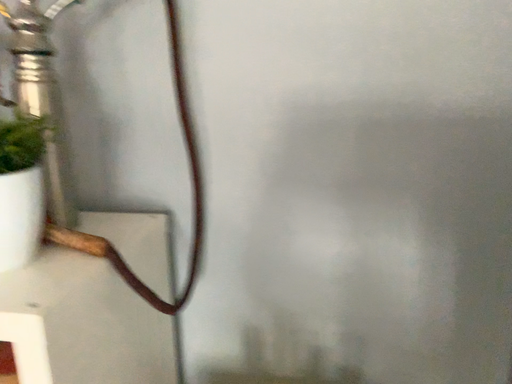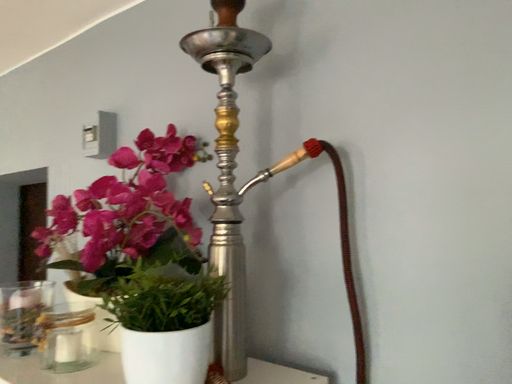
Question: Which way did the camera rotate in the video?

Choices:
 (A) rotated left
 (B) rotated right

Answer: (A)